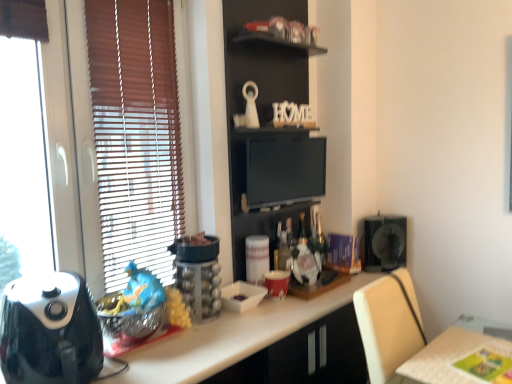
Question: Does matte black monitor at center have a greater width compared to matte red cup at center, the fifth appliance from the left?

Choices:
 (A) no
 (B) yes

Answer: (A)

Question: Considering the relative sizes of matte black monitor at center and matte red cup at center, arranged as the 2th appliance when viewed from the right, in the image provided, is matte black monitor at center smaller than matte red cup at center, arranged as the 2th appliance when viewed from the right,?

Choices:
 (A) no
 (B) yes

Answer: (A)

Question: Is matte black monitor at center shorter than matte red cup at center, arranged as the 2th appliance when viewed from the right?

Choices:
 (A) no
 (B) yes

Answer: (A)

Question: From a real-world perspective, does matte black monitor at center stand above matte red cup at center, arranged as the 2th appliance when viewed from the right?

Choices:
 (A) no
 (B) yes

Answer: (B)

Question: From the image's perspective, is matte black monitor at center on top of matte red cup at center, positioned as the fourth appliance in front-to-back order?

Choices:
 (A) no
 (B) yes

Answer: (B)

Question: Can you confirm if matte black monitor at center is positioned to the left of matte red cup at center, arranged as the 2th appliance when viewed from the right?

Choices:
 (A) no
 (B) yes

Answer: (A)

Question: Does matte black monitor at center have a lesser height compared to white glossy countertop at center?

Choices:
 (A) yes
 (B) no

Answer: (A)

Question: Is matte black monitor at center bigger than white glossy countertop at center?

Choices:
 (A) yes
 (B) no

Answer: (B)

Question: Is matte black monitor at center closer to the viewer compared to white glossy countertop at center?

Choices:
 (A) yes
 (B) no

Answer: (B)

Question: Is matte black monitor at center at the left side of white glossy countertop at center?

Choices:
 (A) yes
 (B) no

Answer: (A)

Question: Does matte black monitor at center have a greater height compared to white glossy countertop at center?

Choices:
 (A) yes
 (B) no

Answer: (B)

Question: From the image's perspective, would you say matte black monitor at center is shown under white glossy countertop at center?

Choices:
 (A) no
 (B) yes

Answer: (A)

Question: From the image's perspective, is wooden bookshelf at upper center located beneath white paper towel holder at center, marked as the third appliance in a right-to-left arrangement?

Choices:
 (A) yes
 (B) no

Answer: (B)